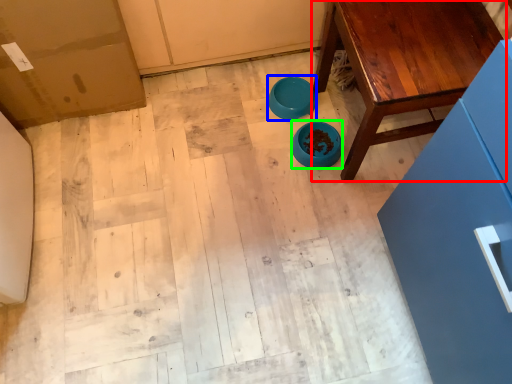
Question: Considering the real-world distances, which object is closest to table (highlighted by a red box)? bowl (highlighted by a blue box) or bowl (highlighted by a green box).

Choices:
 (A) bowl
 (B) bowl

Answer: (B)